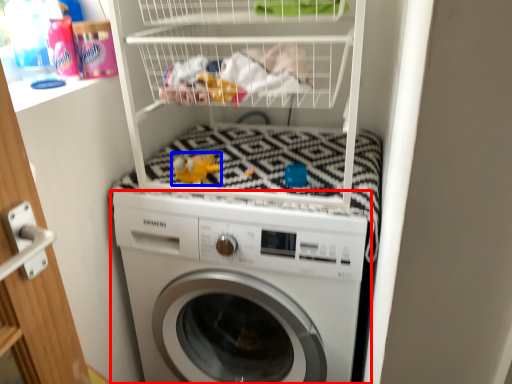
Question: Which object appears farthest to the camera in this image, washing machine (highlighted by a red box) or toy (highlighted by a blue box)?

Choices:
 (A) washing machine
 (B) toy

Answer: (B)